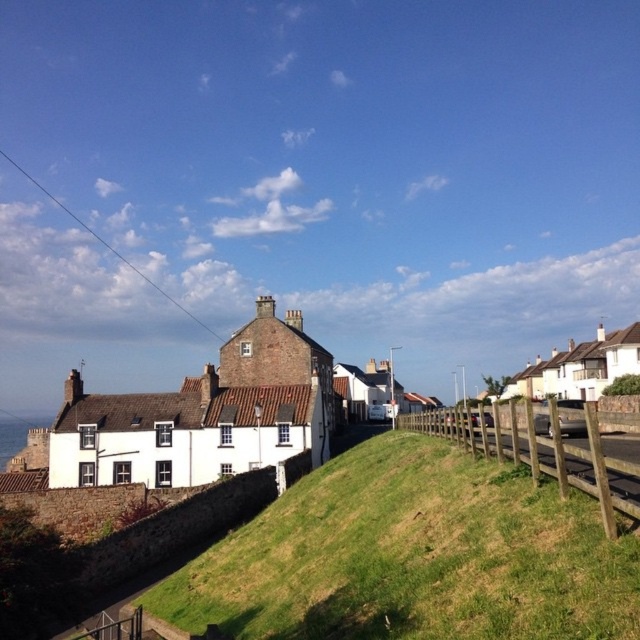
You are standing at the bottom of the green grassy hillside at lower center and want to walk to the wooden fence at lower right. Which direction should you walk to reach the fence without crossing the road?

Since the green grassy hillside at lower center is in front of the wooden fence at lower right, you should walk towards the wooden fence at lower right by moving forward from the green grassy hillside at lower center. However, since the wooden fence at lower right is at the lower right, you need to walk towards the right direction while staying on the grassy area to avoid crossing the road.

You are standing at the point marked as point (412, 556) in the image. Looking around, what do you see immediately in front of you?

The green grassy hillside at lower center is located at point (412, 556), so you would see the green grassy hillside immediately in front of you.

You are standing on the green grassy hillside at lower center and want to walk to the wooden fence at lower right. Which direction should you head to reach it?

Since the green grassy hillside at lower center is below the wooden fence at lower right, you should head upwards to reach the wooden fence at lower right.